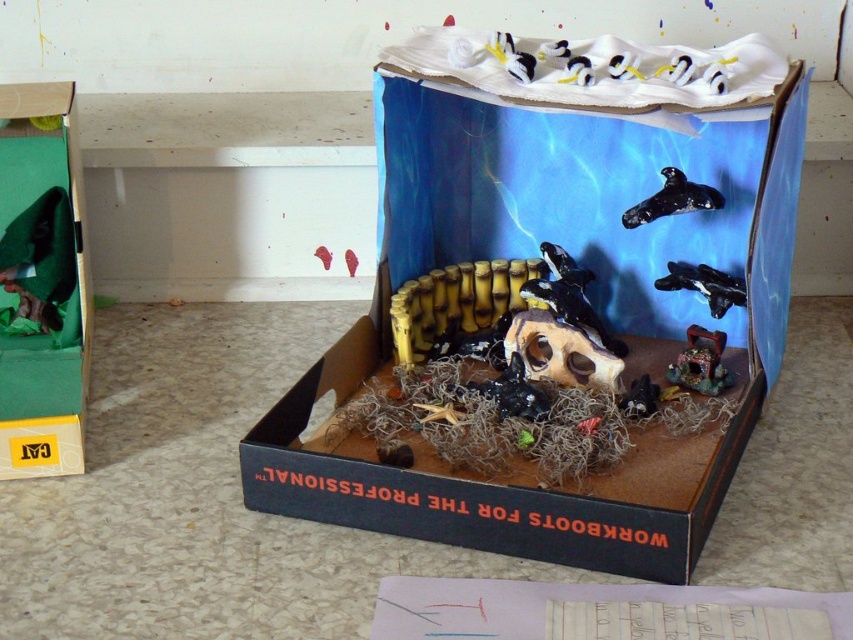
Is shiny metallic treasure chest at center bigger than black glossy whale at center?

No, shiny metallic treasure chest at center is not bigger than black glossy whale at center.

Based on the photo, is shiny metallic treasure chest at center to the right of black glossy whale at center from the viewer's perspective?

Incorrect, shiny metallic treasure chest at center is not on the right side of black glossy whale at center.

Who is more distant from viewer, [718,380] or [689,280]?

The point [689,280] is behind.

This screenshot has width=853, height=640. I want to click on shiny metallic treasure chest at center, so click(x=701, y=362).

Which is more to the left, white glossy penguin at upper center or black matte orca at upper center?

Positioned to the left is white glossy penguin at upper center.

Is point (498, 61) positioned after point (679, 60)?

Yes, point (498, 61) is behind point (679, 60).

The height and width of the screenshot is (640, 853). What are the coordinates of `white glossy penguin at upper center` in the screenshot? It's located at (512, 58).

Find the location of a particular element. white glossy penguin at upper center is located at coordinates (512, 58).

Is black rubber whale at upper center to the left of white glossy penguin at upper center from the viewer's perspective?

Incorrect, black rubber whale at upper center is not on the left side of white glossy penguin at upper center.

Where is `black rubber whale at upper center`? This screenshot has height=640, width=853. black rubber whale at upper center is located at coordinates (672, 198).